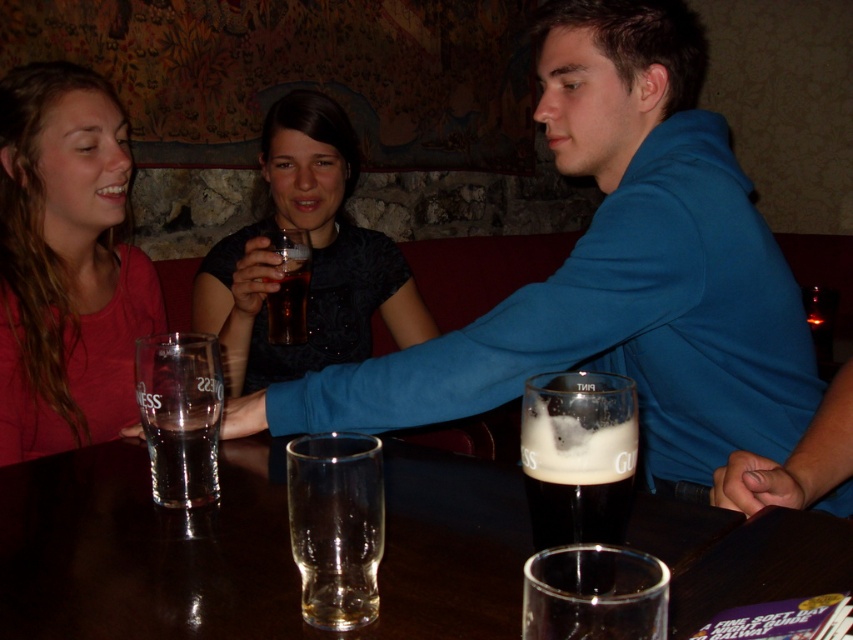
Based on the coordinates provided, where exactly is the clear glass at center located in the image?

The clear glass at center is located at the point with coordinates 0.822 on the x axis and 0.395 on the y axis.

You are a waiter in a pub and need to place a new drink order for the customer seated at the table. The existing transparent glass at center is already on the table. Where should you place the new drink to avoid overlapping with the existing one?

Place the new drink away from the transparent glass at center, which is located at coordinates 0.858 on the x axis and 0.292 on the y axis.

You are a bartender trying to place a new drink order on the table. The table has limited space. Given the transparent glass at center and the matte pink shirt at upper left, which object has more horizontal space available next to it for placing the drink?

Answer: The transparent glass at center has more horizontal space available next to it because its width surpasses that of the matte pink shirt at upper left, meaning there is more room adjacent to it.